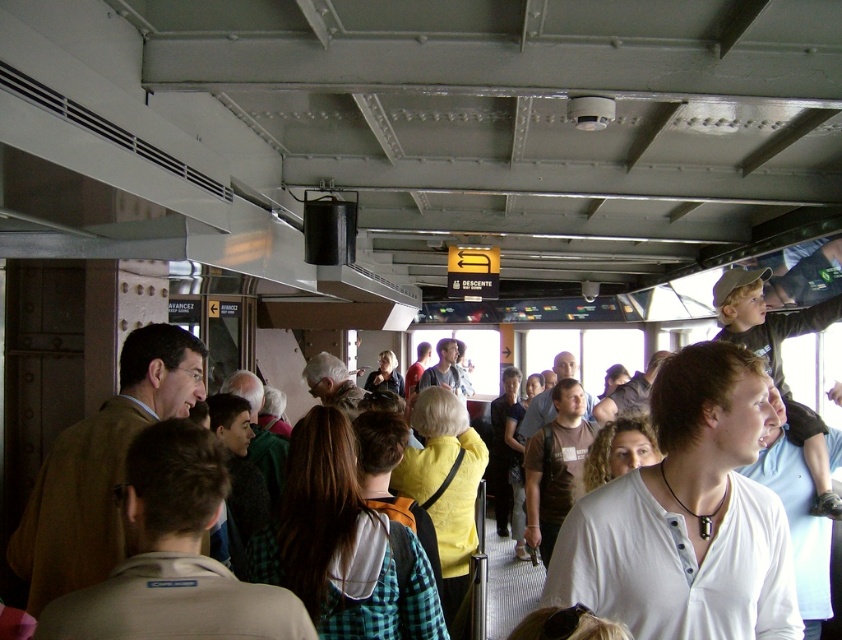
Which of these two, green plaid shirt at center or yellow shirt at center, stands taller?

Standing taller between the two is yellow shirt at center.

Which is in front, point (331, 545) or point (507, 387)?

Point (331, 545) is more forward.

Does point (396, 621) lie in front of point (504, 449)?

That is True.

At what (x,y) coordinates should I click in order to perform the action: click on green plaid shirt at center. Please return your answer as a coordinate pair (x, y). This screenshot has width=842, height=640. Looking at the image, I should click on (344, 545).

Who is more distant from viewer, [582,560] or [459,435]?

The point [459,435] is more distant.

Is white matte shirt at center above yellow matte sweater at center?

Yes.

Which is in front, point (672, 426) or point (451, 410)?

Point (672, 426) is in front.

The width and height of the screenshot is (842, 640). I want to click on white matte shirt at center, so click(686, 516).

Is yellow matte sweater at center thinner than yellow shirt at center?

In fact, yellow matte sweater at center might be wider than yellow shirt at center.

Is point (430, 508) closer to viewer compared to point (507, 532)?

Yes, it is.

What do you see at coordinates (441, 483) in the screenshot? The height and width of the screenshot is (640, 842). I see `yellow matte sweater at center` at bounding box center [441, 483].

Find the location of a particular element. The image size is (842, 640). yellow matte sweater at center is located at coordinates (441, 483).